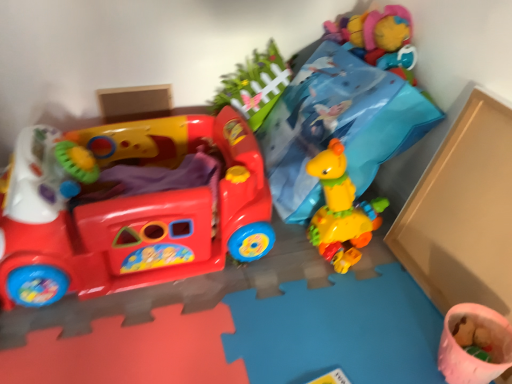
Question: Based on their sizes in the image, would you say pink fabric cup at lower right, the second toy viewed from the left, is bigger or smaller than matte plastic walker at left, positioned as the first toy in top-to-bottom order?

Choices:
 (A) small
 (B) big

Answer: (A)

Question: Considering the positions of pink fabric cup at lower right, which is the second toy in top-to-bottom order, and matte plastic walker at left, positioned as the first toy in top-to-bottom order, in the image, is pink fabric cup at lower right, which is the second toy in top-to-bottom order, taller or shorter than matte plastic walker at left, positioned as the first toy in top-to-bottom order,?

Choices:
 (A) short
 (B) tall

Answer: (A)

Question: Considering the relative positions of pink fabric cup at lower right, which is the second toy in top-to-bottom order, and matte plastic walker at left, placed as the 2th toy when sorted from right to left, in the image provided, is pink fabric cup at lower right, which is the second toy in top-to-bottom order, to the left or to the right of matte plastic walker at left, placed as the 2th toy when sorted from right to left,?

Choices:
 (A) left
 (B) right

Answer: (B)

Question: From a real-world perspective, is matte plastic walker at left, the second toy positioned from the bottom, physically located above or below pink fabric cup at lower right, the first toy from the bottom?

Choices:
 (A) below
 (B) above

Answer: (B)

Question: Considering the relative positions of matte plastic walker at left, acting as the 1th toy starting from the left, and pink fabric cup at lower right, the 1th toy viewed from the right, in the image provided, is matte plastic walker at left, acting as the 1th toy starting from the left, to the left or to the right of pink fabric cup at lower right, the 1th toy viewed from the right,?

Choices:
 (A) right
 (B) left

Answer: (B)

Question: Looking at the image, does matte plastic walker at left, placed as the 2th toy when sorted from right to left, seem bigger or smaller compared to pink fabric cup at lower right, the 1th toy viewed from the right?

Choices:
 (A) small
 (B) big

Answer: (B)

Question: From the image's perspective, is matte plastic walker at left, placed as the 2th toy when sorted from right to left, above or below pink fabric cup at lower right, the 1th toy viewed from the right?

Choices:
 (A) below
 (B) above

Answer: (B)